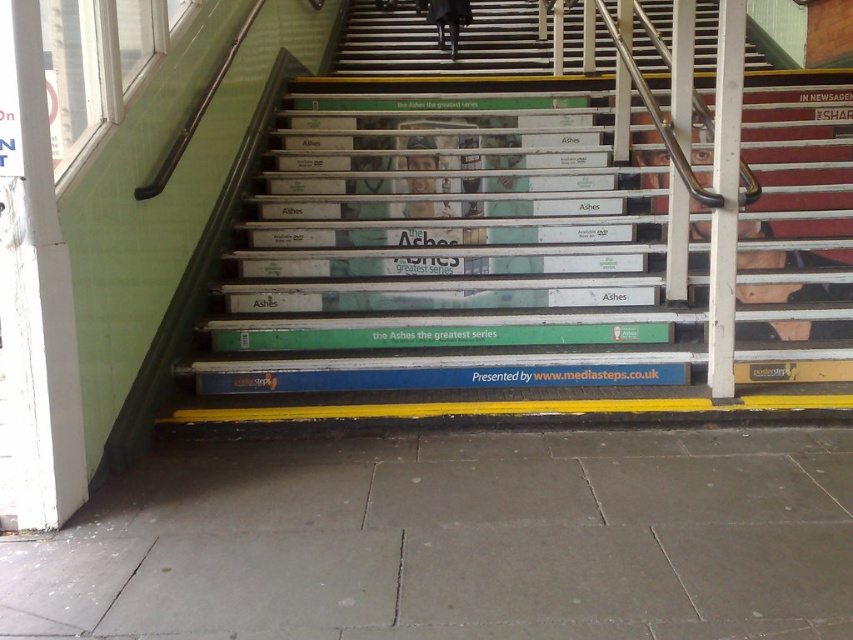
You are standing at the bottom of the staircase and want to place a small decorative item on the white painted wood stairs at upper center without it falling off. Considering the dark clothing at center is placed on the same staircase, which object has a wider surface to ensure the item stays in place?

The white painted wood stairs at upper center has a larger width than the dark clothing at center, so placing the decorative item on the white painted wood stairs at upper center will provide a wider and more stable surface to prevent it from falling off.